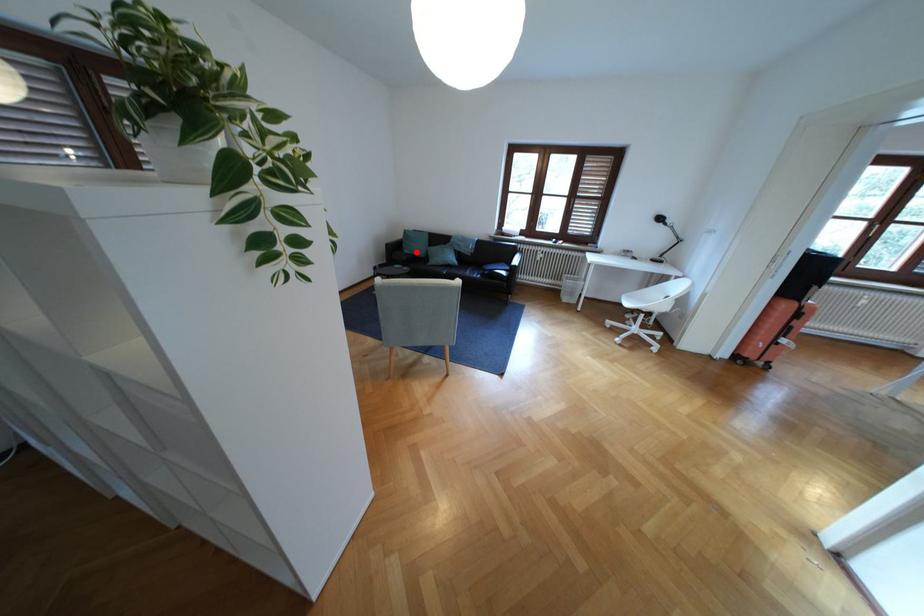
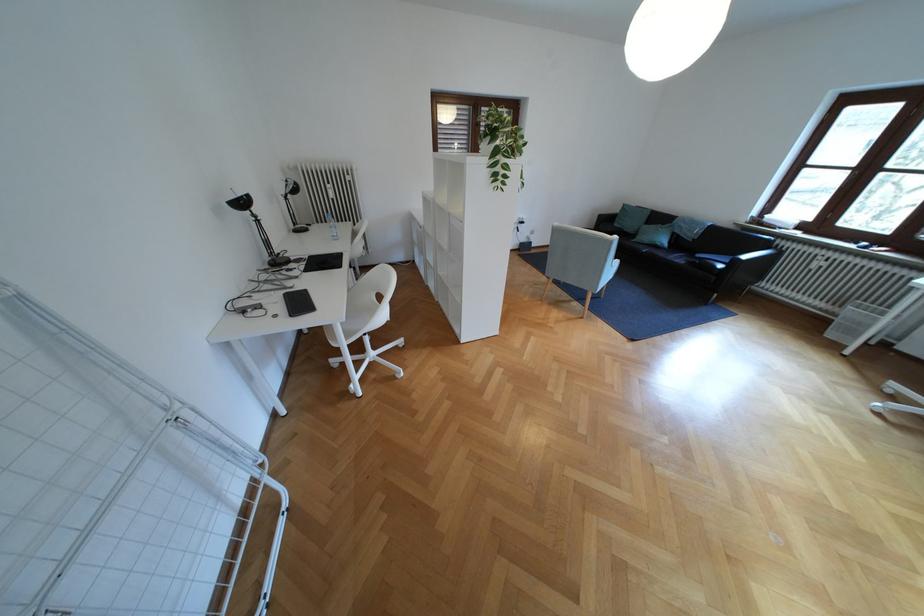
Find the pixel in the second image that matches the highlighted location in the first image.

(626, 225)